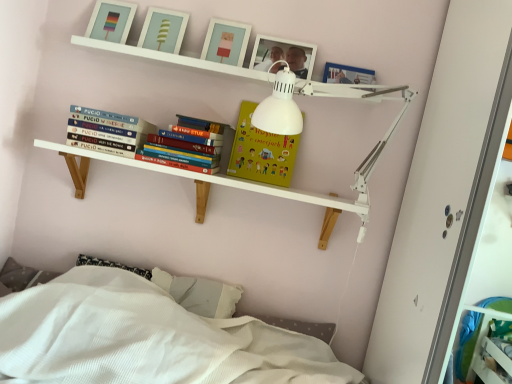
Question: Is matte plastic picture frame at upper center, the 1th picture frame viewed from the left, thinner than white wooden shelf at upper center, which is counted as the second shelf, starting from the top?

Choices:
 (A) yes
 (B) no

Answer: (A)

Question: Is matte plastic picture frame at upper center, the fifth picture frame in the right-to-left sequence, wider than white wooden shelf at upper center, which is counted as the second shelf, starting from the top?

Choices:
 (A) yes
 (B) no

Answer: (B)

Question: Is matte plastic picture frame at upper center, the fifth picture frame in the right-to-left sequence, facing towards white wooden shelf at upper center, which is counted as the second shelf, starting from the top?

Choices:
 (A) yes
 (B) no

Answer: (B)

Question: Can you confirm if matte plastic picture frame at upper center, the 1th picture frame viewed from the left, is smaller than white wooden shelf at upper center, marked as the first shelf in a bottom-to-top arrangement?

Choices:
 (A) yes
 (B) no

Answer: (A)

Question: From the image's perspective, would you say matte plastic picture frame at upper center, the 1th picture frame viewed from the left, is positioned over white wooden shelf at upper center, marked as the first shelf in a bottom-to-top arrangement?

Choices:
 (A) no
 (B) yes

Answer: (B)

Question: In terms of height, does matte white picture frame at upper center, the fourth picture frame viewed from the right, look taller or shorter compared to white wooden shelf at upper center, which is counted as the second shelf, starting from the top?

Choices:
 (A) tall
 (B) short

Answer: (B)

Question: From a real-world perspective, relative to white wooden shelf at upper center, marked as the first shelf in a bottom-to-top arrangement, is matte white picture frame at upper center, the fourth picture frame viewed from the right, vertically above or below?

Choices:
 (A) below
 (B) above

Answer: (B)

Question: Considering their positions, is matte white picture frame at upper center, marked as the 2th picture frame in a left-to-right arrangement, located in front of or behind white wooden shelf at upper center, which is counted as the second shelf, starting from the top?

Choices:
 (A) behind
 (B) front

Answer: (A)

Question: From the image's perspective, is matte white picture frame at upper center, the fourth picture frame viewed from the right, located above or below white wooden shelf at upper center, marked as the first shelf in a bottom-to-top arrangement?

Choices:
 (A) above
 (B) below

Answer: (A)

Question: From the image's perspective, is wooden picture frame at upper center, placed as the 2th picture frame when sorted from right to left, above or below matte plastic picture frame at upper center, the 1th picture frame viewed from the left?

Choices:
 (A) above
 (B) below

Answer: (B)

Question: In terms of width, does wooden picture frame at upper center, placed as the 2th picture frame when sorted from right to left, look wider or thinner when compared to matte plastic picture frame at upper center, the 1th picture frame viewed from the left?

Choices:
 (A) thin
 (B) wide

Answer: (B)

Question: In the image, is wooden picture frame at upper center, which is the fourth picture frame in left-to-right order, on the left side or the right side of matte plastic picture frame at upper center, the fifth picture frame in the right-to-left sequence?

Choices:
 (A) right
 (B) left

Answer: (A)

Question: Considering their positions, is wooden picture frame at upper center, placed as the 2th picture frame when sorted from right to left, located in front of or behind matte plastic picture frame at upper center, the 1th picture frame viewed from the left?

Choices:
 (A) front
 (B) behind

Answer: (A)

Question: Is wooden picture frame at upper center, positioned as the first picture frame in right-to-left order, inside the boundaries of matte white picture frame at upper center, which is counted as the 3th picture frame, starting from the left, or outside?

Choices:
 (A) inside
 (B) outside

Answer: (B)

Question: Is point (361, 79) positioned closer to the camera than point (240, 54)?

Choices:
 (A) farther
 (B) closer

Answer: (A)